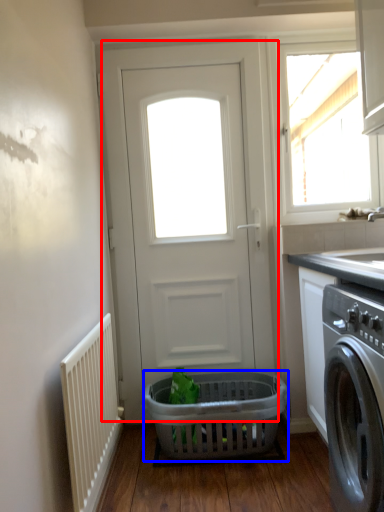
Question: Which object appears closest to the camera in this image, door (highlighted by a red box) or basket (highlighted by a blue box)?

Choices:
 (A) door
 (B) basket

Answer: (B)